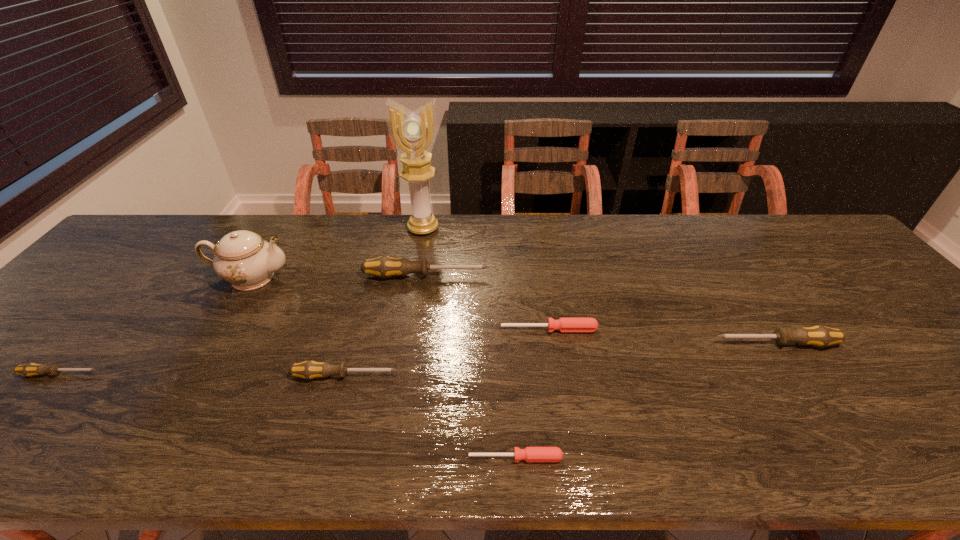
Locate an element on the screen. The height and width of the screenshot is (540, 960). free space located at the tip of the fifth farthest object is located at coordinates (660, 343).

Locate an element on the screen. The image size is (960, 540). vacant space located 0.090m at the tip of the fifth farthest object is located at coordinates (676, 343).

You are a GUI agent. You are given a task and a screenshot of the screen. Output one action in this format:
    pyautogui.click(x=<x>, y=<y>)
    Task: Click on the vacant space located at the tip of the fourth shortest screwdriver
    
    Given the screenshot: What is the action you would take?
    pyautogui.click(x=420, y=376)

The width and height of the screenshot is (960, 540). Find the location of `vacant region located 0.170m on the left of the second farthest screwdriver`. vacant region located 0.170m on the left of the second farthest screwdriver is located at coordinates (433, 329).

Locate an element on the screen. The width and height of the screenshot is (960, 540). free region located at the tip of the smallest gray screwdriver is located at coordinates (228, 374).

Where is `vacant region located on the right of the shortest object`? vacant region located on the right of the shortest object is located at coordinates (769, 458).

In order to click on object positioned at the far edge in this screenshot , I will do `click(413, 133)`.

What are the coordinates of `object located at the near edge` in the screenshot? It's located at (530, 454).

The image size is (960, 540). Find the location of `object that is at the left edge`. object that is at the left edge is located at coordinates pyautogui.click(x=31, y=369).

Find the location of a particular element. vacant space at the far edge of the desktop is located at coordinates (711, 247).